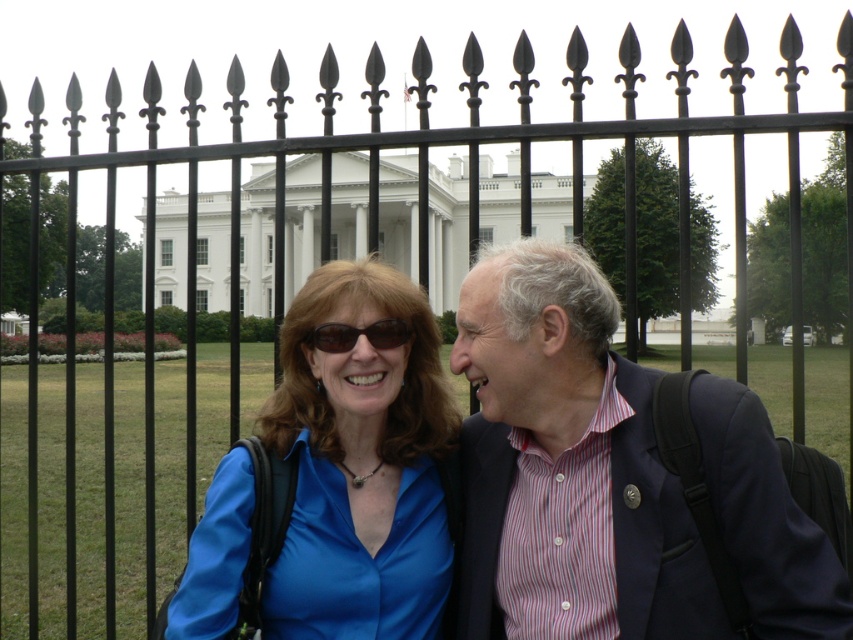
You are a photographer aiming to capture a clear shot of both the blue satin blouse at center and the matte black sunglasses at center. Which object will appear larger in your photo?

The blue satin blouse at center will appear larger in the photo because it is closer to the viewer than the matte black sunglasses at center.

You are a photographer aiming to capture a candid shot of the striped cotton shirt at center and the matte black sunglasses at center. Since you want to ensure both are in focus, you need to know their spatial relationship. Which object is positioned to the right of the other?

The striped cotton shirt at center is to the right of the matte black sunglasses at center.